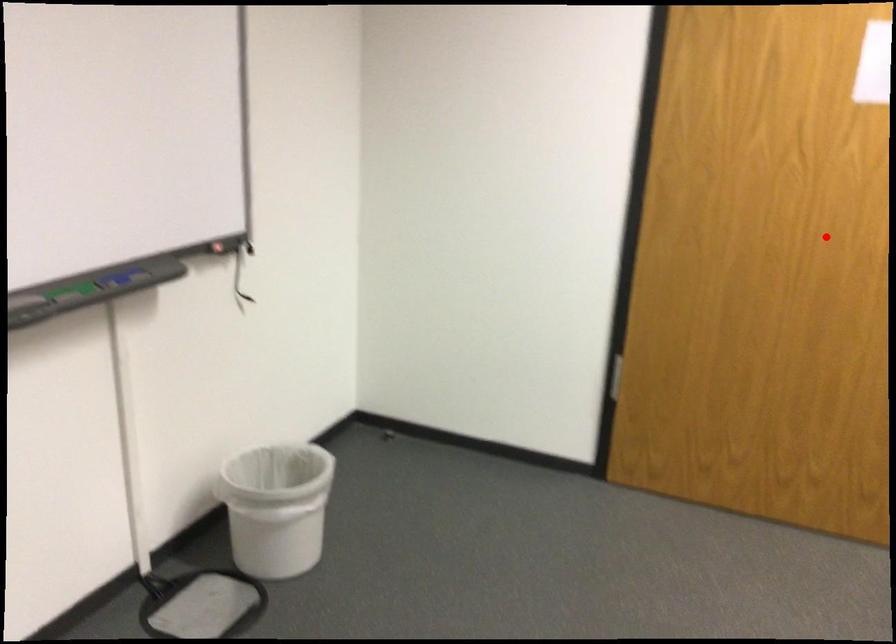
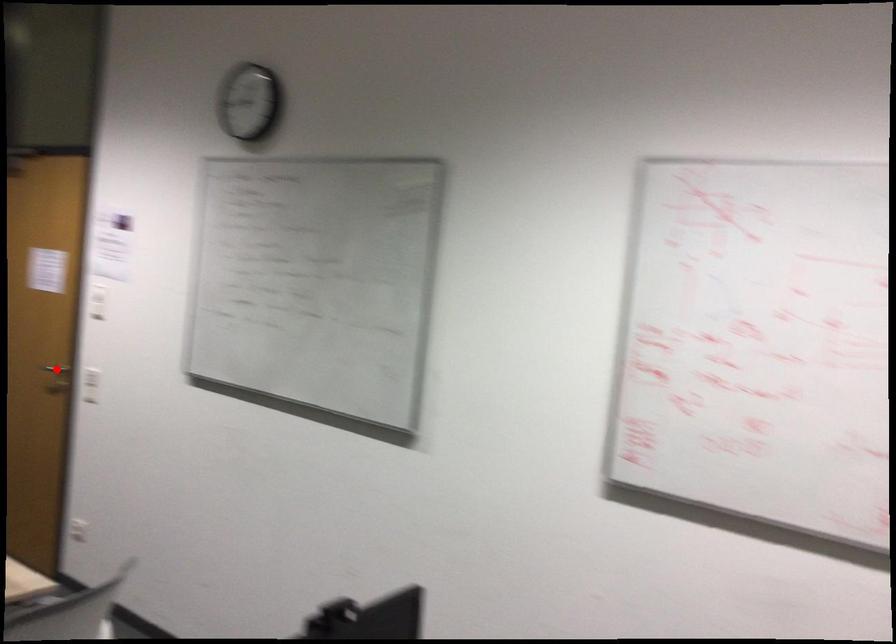
I am providing you with two images of the same scene from different viewpoints. A red point is marked on the first image and another point is marked on the second image. Do the highlighted points in image1 and image2 indicate the same real-world spot?

Yes